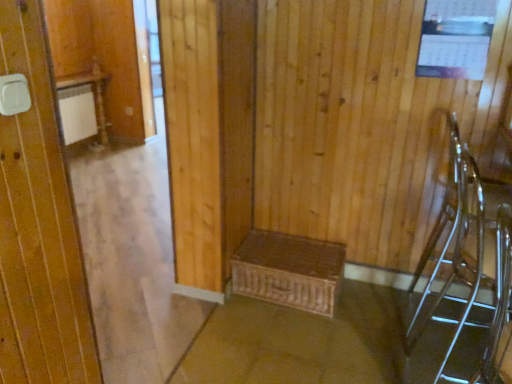
The height and width of the screenshot is (384, 512). I want to click on vacant area that is situated to the right of woven brown chest at center, so click(x=375, y=309).